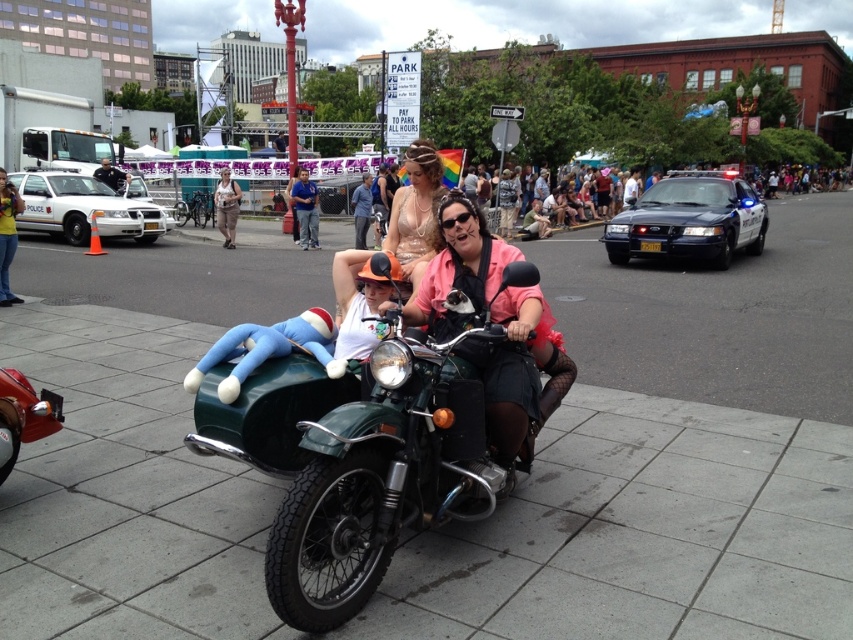
Question: Is green matte motorcycle at center wider than matte beige dress at center?

Choices:
 (A) no
 (B) yes

Answer: (B)

Question: Does shiny gold dress at center have a smaller size compared to matte black helmet at center?

Choices:
 (A) no
 (B) yes

Answer: (A)

Question: Considering the real-world distances, which object is closest to the shiny gold dress at center?

Choices:
 (A) pink satin dress at center
 (B) green matte motorcycle at center

Answer: (A)

Question: Which is farther from the pink satin dress at center?

Choices:
 (A) matte black helmet at center
 (B) matte beige dress at center

Answer: (A)

Question: Can you confirm if green matte motorcycle at center is positioned above shiny gold dress at center?

Choices:
 (A) no
 (B) yes

Answer: (A)

Question: Estimate the real-world distances between objects in this image. Which object is closer to the matte beige dress at center?

Choices:
 (A) matte black helmet at center
 (B) green matte motorcycle at center

Answer: (A)